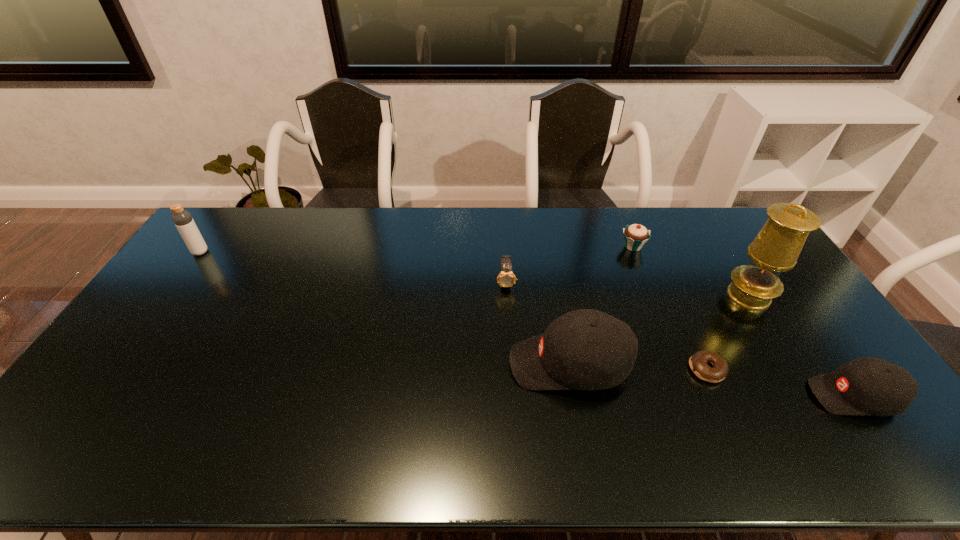
Where is `free space between the bottle and the cupcake`? Image resolution: width=960 pixels, height=540 pixels. free space between the bottle and the cupcake is located at coordinates (417, 249).

The image size is (960, 540). I want to click on free space that is in between the oil lamp and the right baseball cap, so click(802, 346).

Locate an element on the screen. Image resolution: width=960 pixels, height=540 pixels. empty space between the watch and the cupcake is located at coordinates (569, 264).

This screenshot has width=960, height=540. Identify the location of free space between the doughnut and the third tallest object. (638, 367).

Identify the location of vacant point located between the tallest object and the cupcake. This screenshot has height=540, width=960. (691, 271).

Locate an element on the screen. This screenshot has height=540, width=960. vacant point located between the cupcake and the tallest object is located at coordinates (691, 271).

The width and height of the screenshot is (960, 540). I want to click on vacant space in between the taller baseball cap and the watch, so click(538, 323).

Where is `vacant area that lies between the right baseball cap and the cupcake`? The width and height of the screenshot is (960, 540). vacant area that lies between the right baseball cap and the cupcake is located at coordinates (743, 321).

The image size is (960, 540). I want to click on empty space that is in between the doughnut and the oil lamp, so click(728, 333).

I want to click on object that is the fourth closest to the third tallest object, so click(x=776, y=248).